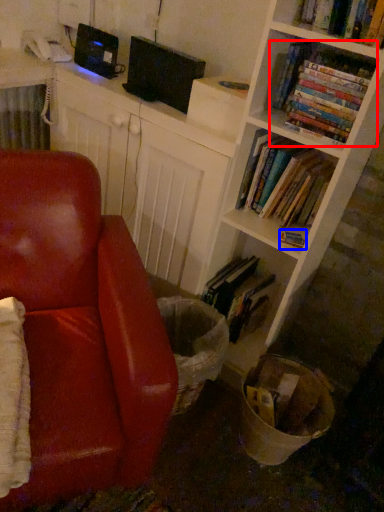
Question: Among these objects, which one is farthest to the camera, book (highlighted by a red box) or book (highlighted by a blue box)?

Choices:
 (A) book
 (B) book

Answer: (B)